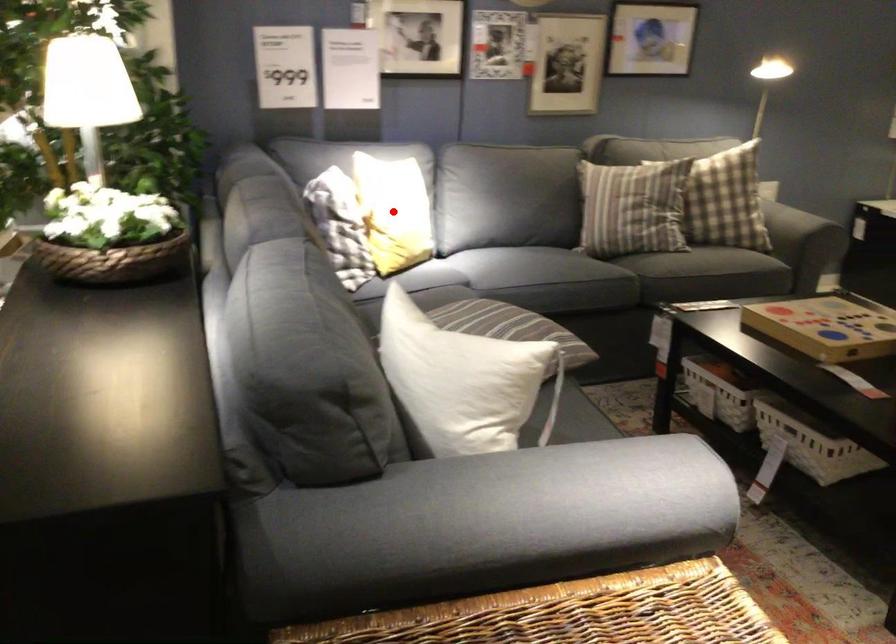
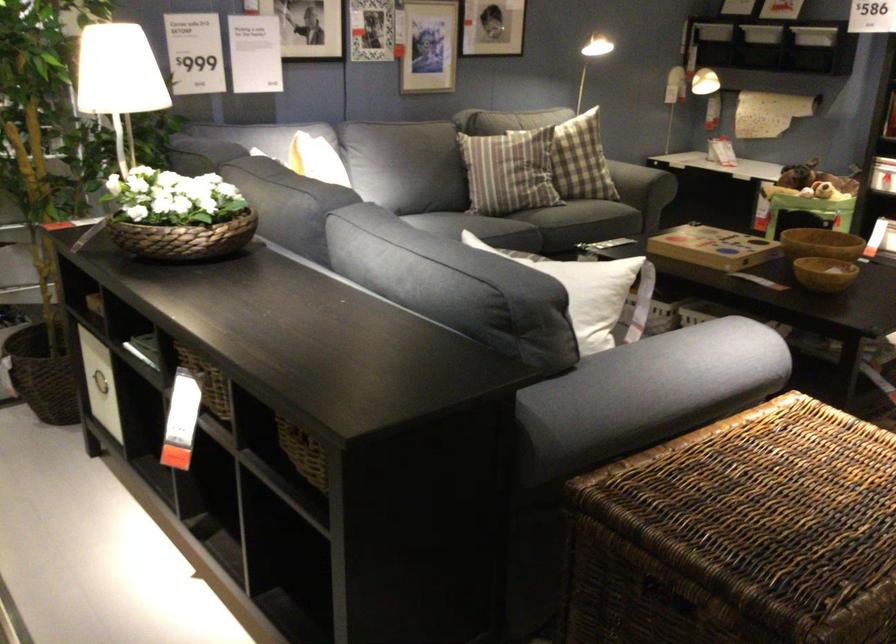
Question: I am providing you with two images of the same scene from different viewpoints. A red point is marked on the first image. Can you still see the location of the red point in image 2?

Choices:
 (A) Yes
 (B) No

Answer: (B)